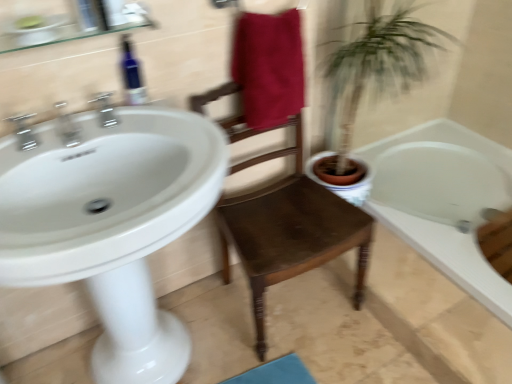
Question: Considering the positions of maroon fabric towel at center and chrome metallic faucet at upper left, positioned as the first tap in left-to-right order, in the image, is maroon fabric towel at center taller or shorter than chrome metallic faucet at upper left, positioned as the first tap in left-to-right order,?

Choices:
 (A) short
 (B) tall

Answer: (B)

Question: Looking at the image, does maroon fabric towel at center seem bigger or smaller compared to chrome metallic faucet at upper left, which appears as the 3th tap when viewed from the right?

Choices:
 (A) big
 (B) small

Answer: (A)

Question: Which object is the closest to the white glossy sink at left?

Choices:
 (A) brown wooden chair at center
 (B) silver metallic faucet at upper left, acting as the third tap starting from the left
 (C) chrome metallic faucet at upper left, positioned as the first tap in left-to-right order
 (D) blue glass bottle at upper left
 (E) white glossy bathtub at lower right

Answer: (B)

Question: Which of these objects is positioned closest to the chrome metallic faucet at upper left, acting as the 2th tap starting from the right?

Choices:
 (A) silver metallic faucet at upper left, acting as the third tap starting from the left
 (B) blue glass bottle at upper left
 (C) white glossy sink at left
 (D) brown wooden chair at center
 (E) white glossy bathtub at lower right

Answer: (A)